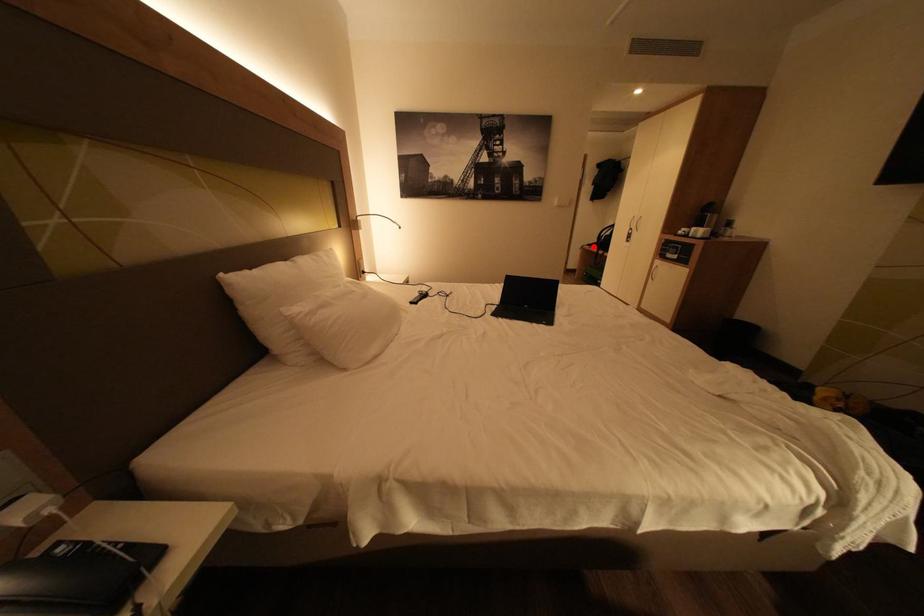
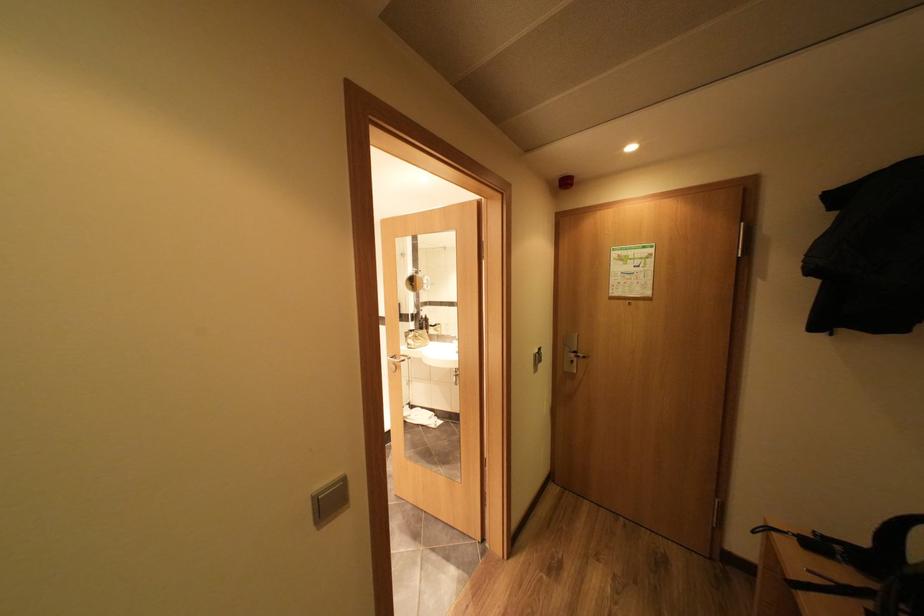
Where in the second image is the point corresponding to the highlighted location from the first image?

(779, 529)